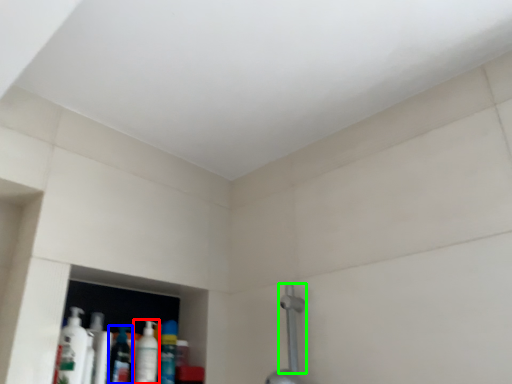
Question: Based on their relative distances, which object is farther from mouthwash (highlighted by a red box)? Choose from mouthwash (highlighted by a blue box) and shower (highlighted by a green box).

Choices:
 (A) mouthwash
 (B) shower

Answer: (B)